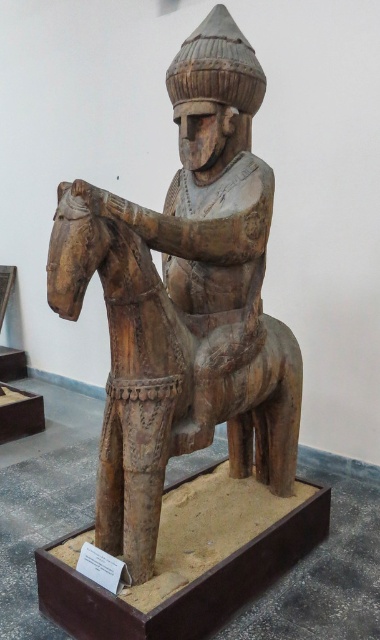
Between point (164, 433) and point (239, 244), which one is positioned in front?

Point (164, 433)

Between point (256, 362) and point (235, 305), which one is positioned in front?

Point (235, 305) is in front.

Find the location of a particular element. wooden horse at center is located at coordinates (126, 369).